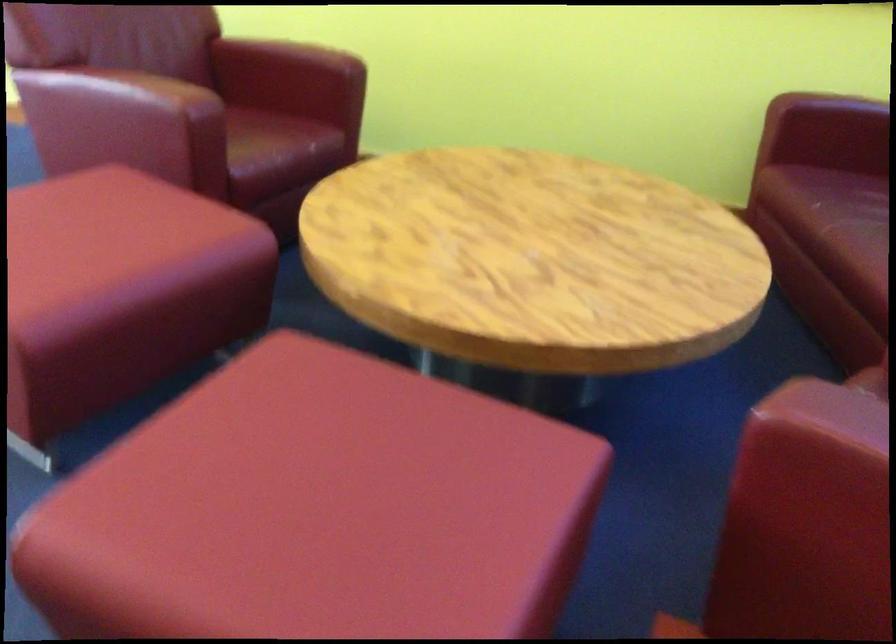
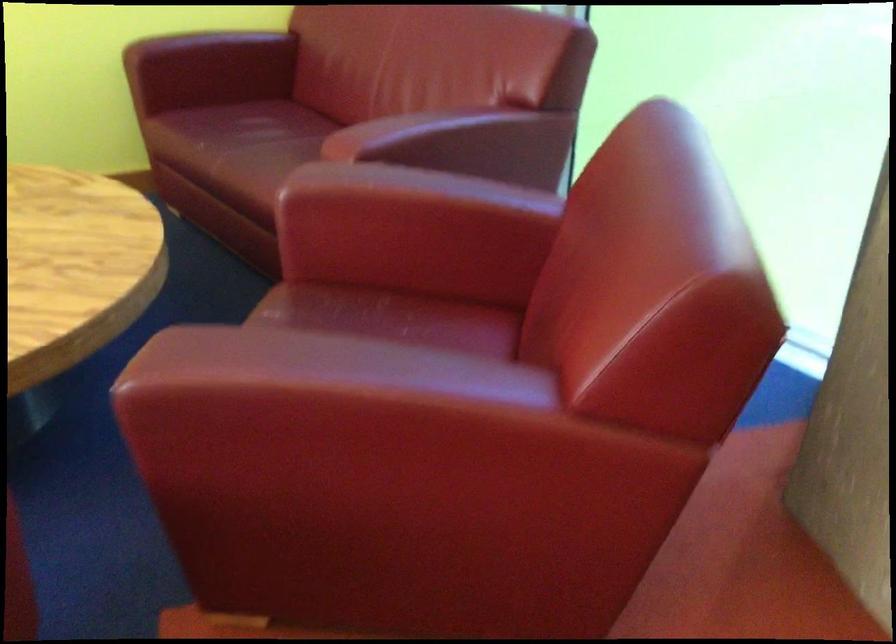
Locate, in the second image, the point that corresponds to point (805, 440) in the first image.

(177, 386)